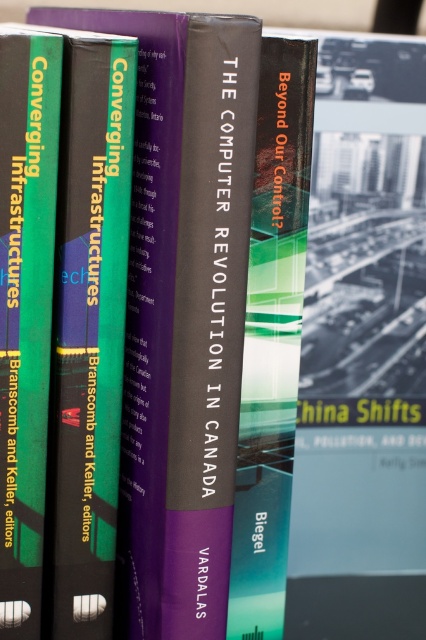
You are a librarian organizing books on a shelf. The shelf has a maximum length of 1 meter. The hardcover book at center has a length of 30 cm. Can you place it on the shelf without exceeding the shelf length?

The hardcover book at center has a length of 30 cm, which is less than the 1 meter shelf length. Yes, it can be placed on the shelf without exceeding the limit.

You are holding a camera and want to take a photo of the green matte book at center. The camera has a minimum focusing distance of 40 centimeters. Can you take a clear photo without moving the camera or the book?

The green matte book at center and camera are 39.60 centimeters apart from each other. Since the minimum focusing distance is 40 centimeters, the camera cannot focus clearly at 39.60 centimeters. Therefore, you cannot take a clear photo without moving either the camera or the book.